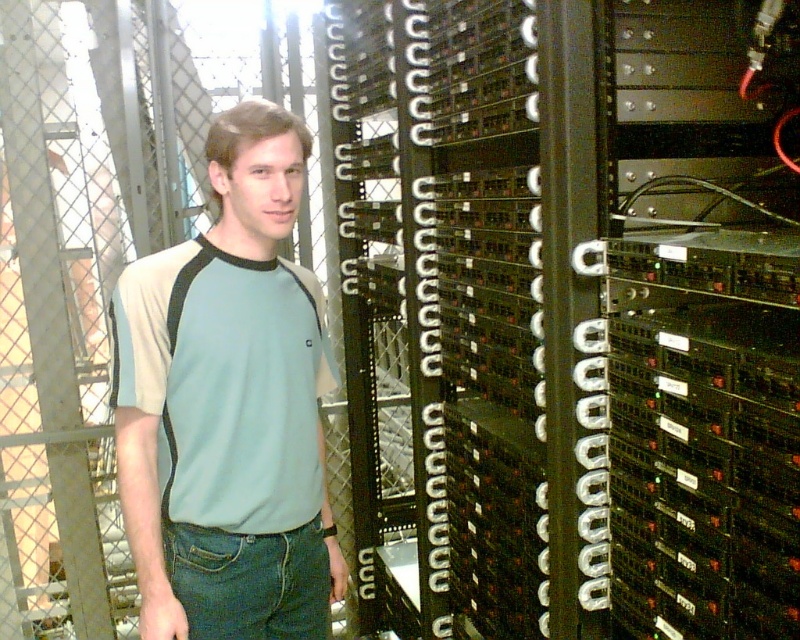
Question: Can you confirm if black metal server rack at center is smaller than light blue cotton t-shirt at center?

Choices:
 (A) yes
 (B) no

Answer: (B)

Question: Can you confirm if black metal server rack at center is wider than light blue cotton t-shirt at center?

Choices:
 (A) yes
 (B) no

Answer: (A)

Question: Among these points, which one is nearest to the camera?

Choices:
 (A) (272, 186)
 (B) (480, 298)

Answer: (A)

Question: Which point is farther from the camera taking this photo?

Choices:
 (A) (254, 436)
 (B) (628, 492)

Answer: (A)

Question: Which object appears closest to the camera in this image?

Choices:
 (A) black metal server rack at center
 (B) light blue cotton t-shirt at center

Answer: (A)

Question: Can you confirm if black metal server rack at center is positioned above light blue cotton t-shirt at center?

Choices:
 (A) no
 (B) yes

Answer: (B)